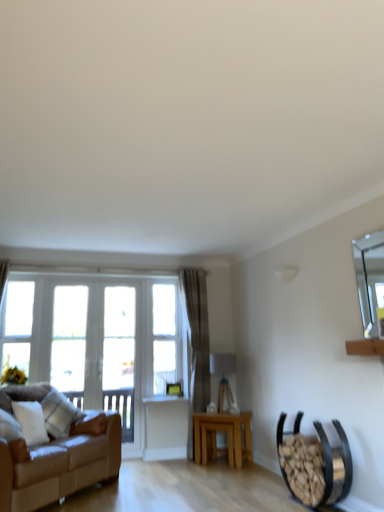
Question: From a real-world perspective, is clear glass window at left, positioned as the 2th window in left-to-right order, physically below clear glass window at center, arranged as the 3th window when viewed from the left?

Choices:
 (A) no
 (B) yes

Answer: (B)

Question: Is clear glass window at left, which is the second window from right to left, further to camera compared to clear glass window at center, the 1th window from the right?

Choices:
 (A) no
 (B) yes

Answer: (A)

Question: From a real-world perspective, is clear glass window at left, which is the second window from right to left, on top of clear glass window at center, arranged as the 3th window when viewed from the left?

Choices:
 (A) yes
 (B) no

Answer: (B)

Question: Can you confirm if clear glass window at left, which is the second window from right to left, is thinner than clear glass window at center, the 1th window from the right?

Choices:
 (A) yes
 (B) no

Answer: (B)

Question: Is clear glass window at center, arranged as the 3th window when viewed from the left, a part of clear glass window at left, positioned as the 2th window in left-to-right order?

Choices:
 (A) yes
 (B) no

Answer: (B)

Question: From the image's perspective, relative to white sheer curtain at left, the first curtain in the front-to-back sequence, is white painted wood window frame at center above or below?

Choices:
 (A) above
 (B) below

Answer: (B)

Question: Considering the positions of white painted wood window frame at center and white sheer curtain at left, the first curtain in the front-to-back sequence, in the image, is white painted wood window frame at center taller or shorter than white sheer curtain at left, the first curtain in the front-to-back sequence,?

Choices:
 (A) short
 (B) tall

Answer: (B)

Question: From a real-world perspective, relative to white sheer curtain at left, the first curtain in the front-to-back sequence, is white painted wood window frame at center vertically above or below?

Choices:
 (A) below
 (B) above

Answer: (A)

Question: Is point (122, 414) positioned closer to the camera than point (1, 271)?

Choices:
 (A) farther
 (B) closer

Answer: (A)

Question: Is white wood glass door at left to the left or to the right of brown leather couch at left in the image?

Choices:
 (A) left
 (B) right

Answer: (B)

Question: Considering the positions of white wood glass door at left and brown leather couch at left in the image, is white wood glass door at left wider or thinner than brown leather couch at left?

Choices:
 (A) thin
 (B) wide

Answer: (A)

Question: Choose the correct answer: Is white wood glass door at left inside brown leather couch at left or outside it?

Choices:
 (A) inside
 (B) outside

Answer: (B)

Question: In terms of height, does white wood glass door at left look taller or shorter compared to brown leather couch at left?

Choices:
 (A) tall
 (B) short

Answer: (A)

Question: Would you say white sheer curtain at left, placed as the 2th curtain when sorted from right to left, is inside or outside white wood glass door at left?

Choices:
 (A) outside
 (B) inside

Answer: (A)

Question: From the image's perspective, is white sheer curtain at left, placed as the 2th curtain when sorted from right to left, located above or below white wood glass door at left?

Choices:
 (A) above
 (B) below

Answer: (A)